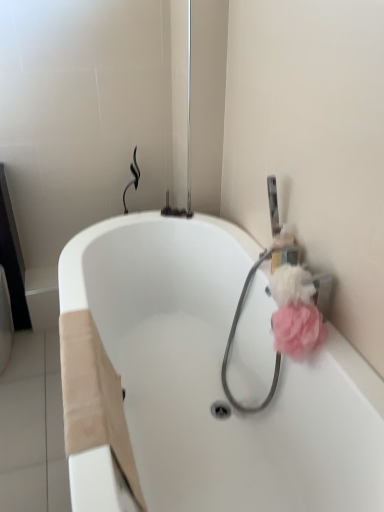
Question: Can you confirm if pink fluffy sponge at right, placed as the 2th flower when sorted from bottom to top, is smaller than pink fabric garden hose at upper right?

Choices:
 (A) yes
 (B) no

Answer: (A)

Question: From the image's perspective, is pink fluffy sponge at right, which appears as the 1th flower when viewed from the top, beneath pink fabric garden hose at upper right?

Choices:
 (A) no
 (B) yes

Answer: (A)

Question: Is pink fluffy sponge at right, which appears as the 1th flower when viewed from the top, to the left of pink fabric garden hose at upper right from the viewer's perspective?

Choices:
 (A) no
 (B) yes

Answer: (A)

Question: From a real-world perspective, is pink fluffy sponge at right, placed as the 2th flower when sorted from bottom to top, under pink fabric garden hose at upper right?

Choices:
 (A) yes
 (B) no

Answer: (B)

Question: From a real-world perspective, is pink fluffy sponge at right, placed as the 2th flower when sorted from bottom to top, positioned over pink fabric garden hose at upper right based on gravity?

Choices:
 (A) no
 (B) yes

Answer: (B)

Question: Does pink fluffy sponge at right, placed as the 2th flower when sorted from bottom to top, appear on the right side of pink fabric garden hose at upper right?

Choices:
 (A) yes
 (B) no

Answer: (A)

Question: Could you tell me if pink fluffy sponge at right, arranged as the 2th flower when viewed from the top, is turned towards pink fluffy sponge at right, placed as the 2th flower when sorted from bottom to top?

Choices:
 (A) yes
 (B) no

Answer: (B)

Question: Is the depth of pink fluffy sponge at right, arranged as the 2th flower when viewed from the top, greater than that of pink fluffy sponge at right, placed as the 2th flower when sorted from bottom to top?

Choices:
 (A) yes
 (B) no

Answer: (B)

Question: Would you consider pink fluffy sponge at right, the 1th flower ordered from the bottom, to be distant from pink fluffy sponge at right, placed as the 2th flower when sorted from bottom to top?

Choices:
 (A) no
 (B) yes

Answer: (A)

Question: Is pink fluffy sponge at right, arranged as the 2th flower when viewed from the top, beside pink fluffy sponge at right, which appears as the 1th flower when viewed from the top?

Choices:
 (A) yes
 (B) no

Answer: (A)

Question: Is pink fluffy sponge at right, the 1th flower ordered from the bottom, smaller than pink fluffy sponge at right, placed as the 2th flower when sorted from bottom to top?

Choices:
 (A) no
 (B) yes

Answer: (A)

Question: Is pink fluffy sponge at right, arranged as the 2th flower when viewed from the top, turned away from pink fluffy sponge at right, placed as the 2th flower when sorted from bottom to top?

Choices:
 (A) yes
 (B) no

Answer: (A)

Question: Are white glossy bathtub at center and pink fluffy sponge at right, the 1th flower ordered from the bottom, making contact?

Choices:
 (A) no
 (B) yes

Answer: (A)